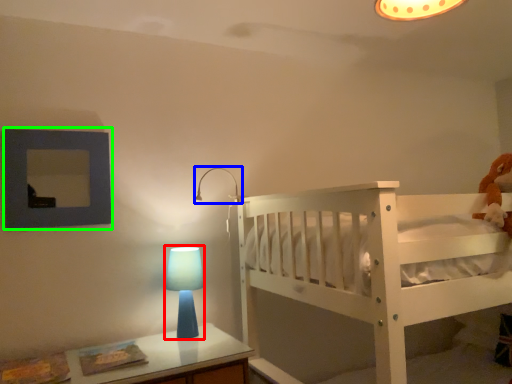
Question: Estimate the real-world distances between objects in this image. Which object is farther from table lamp (highlighted by a red box), lamp (highlighted by a blue box) or picture frame (highlighted by a green box)?

Choices:
 (A) lamp
 (B) picture frame

Answer: (B)